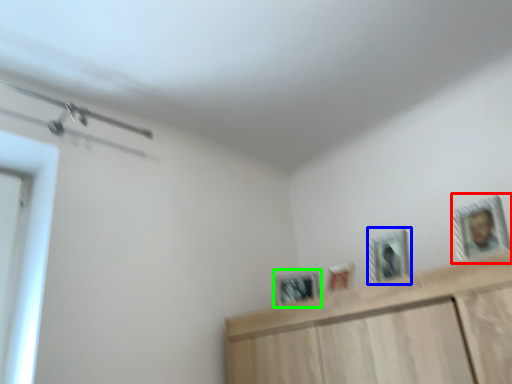
Question: Which object is positioned farthest from picture frame (highlighted by a red box)? Select from picture frame (highlighted by a blue box) and picture frame (highlighted by a green box).

Choices:
 (A) picture frame
 (B) picture frame

Answer: (B)